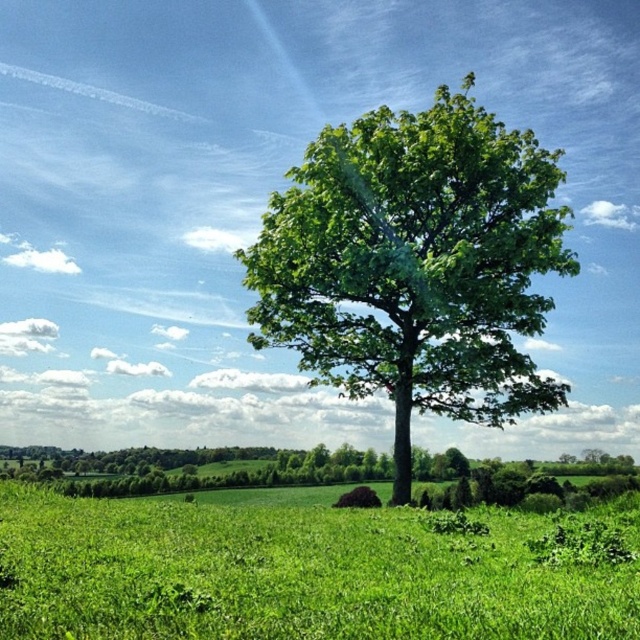
Question: Can you confirm if green grassy field at center is positioned to the right of green leafy tree at center?

Choices:
 (A) no
 (B) yes

Answer: (A)

Question: Does green grassy field at center appear on the right side of green leafy tree at center?

Choices:
 (A) no
 (B) yes

Answer: (A)

Question: Can you confirm if green grassy field at center is wider than green leafy tree at center?

Choices:
 (A) yes
 (B) no

Answer: (A)